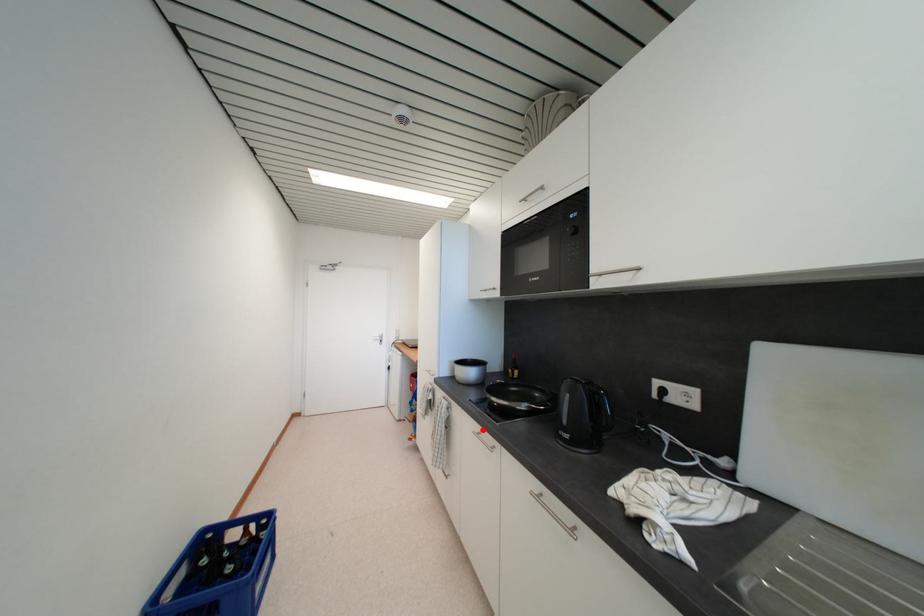
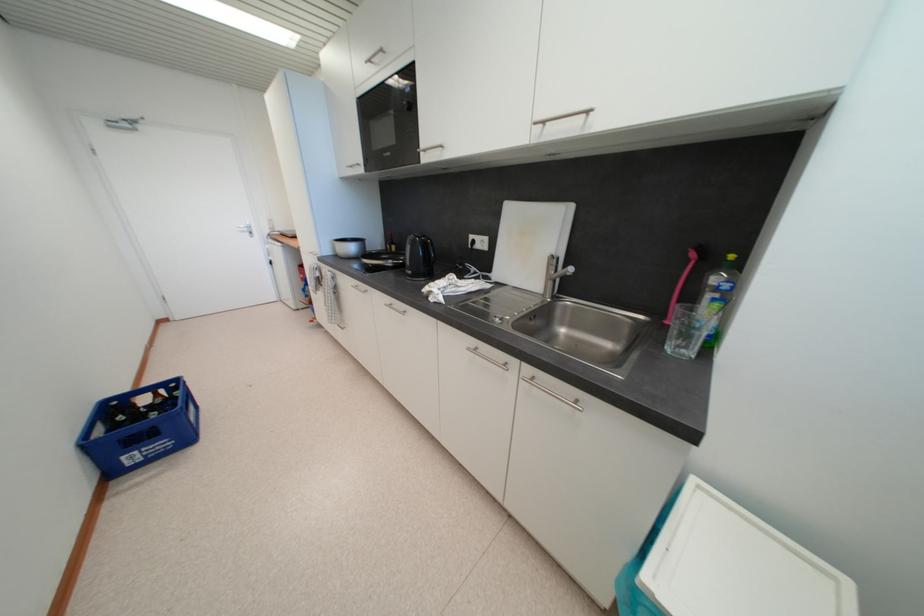
Find the pixel in the second image that matches the highlighted location in the first image.

(359, 285)